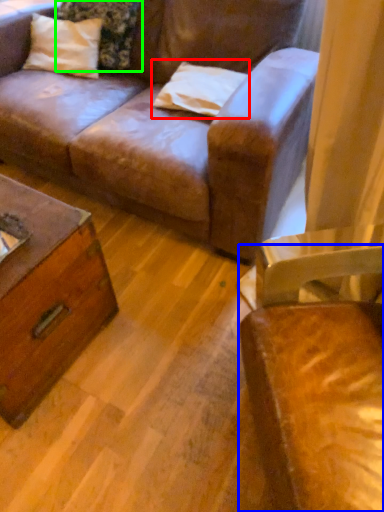
Question: Estimate the real-world distances between objects in this image. Which object is farther from pillow (highlighted by a red box), chair (highlighted by a blue box) or pillow (highlighted by a green box)?

Choices:
 (A) chair
 (B) pillow

Answer: (A)